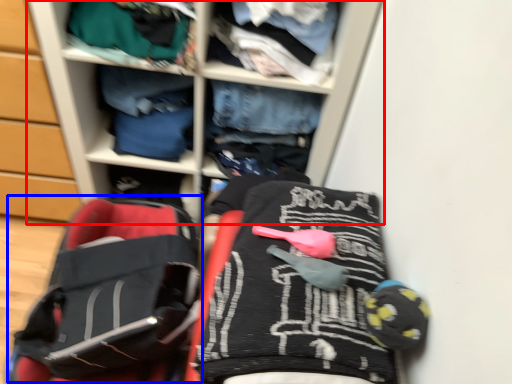
Question: Which of the following is the closest to the observer, shelf (highlighted by a red box) or baby carriage (highlighted by a blue box)?

Choices:
 (A) shelf
 (B) baby carriage

Answer: (A)